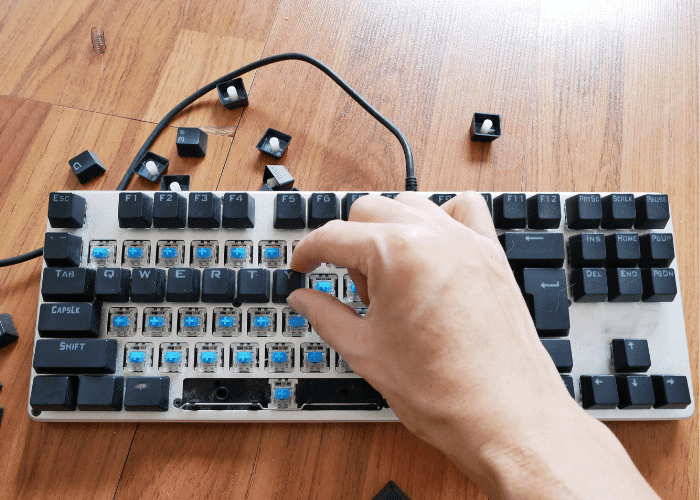
The image size is (700, 500). Identify the location of keyboard wire. (391, 123).